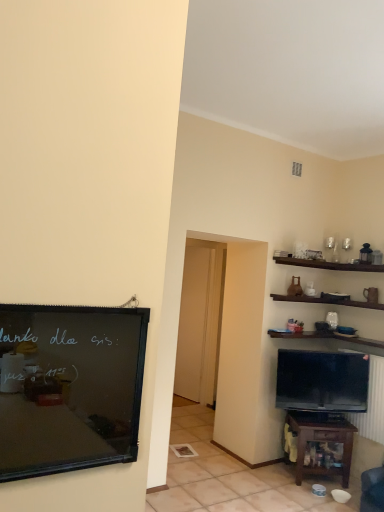
Question: Is brown wooden table at lower right bigger or smaller than matte black tv at lower right?

Choices:
 (A) big
 (B) small

Answer: (A)

Question: Is brown wooden table at lower right to the left or to the right of matte black tv at lower right in the image?

Choices:
 (A) left
 (B) right

Answer: (A)

Question: Estimate the real-world distances between objects in this image. Which object is closer to the brown wooden table at lower right?

Choices:
 (A) matte black tv at lower right
 (B) transparent glass door at center
 (C) black matte bulletin board at left

Answer: (A)

Question: Based on their relative distances, which object is farther from the black matte bulletin board at left?

Choices:
 (A) transparent glass door at center
 (B) matte black tv at lower right
 (C) brown wooden table at lower right

Answer: (A)